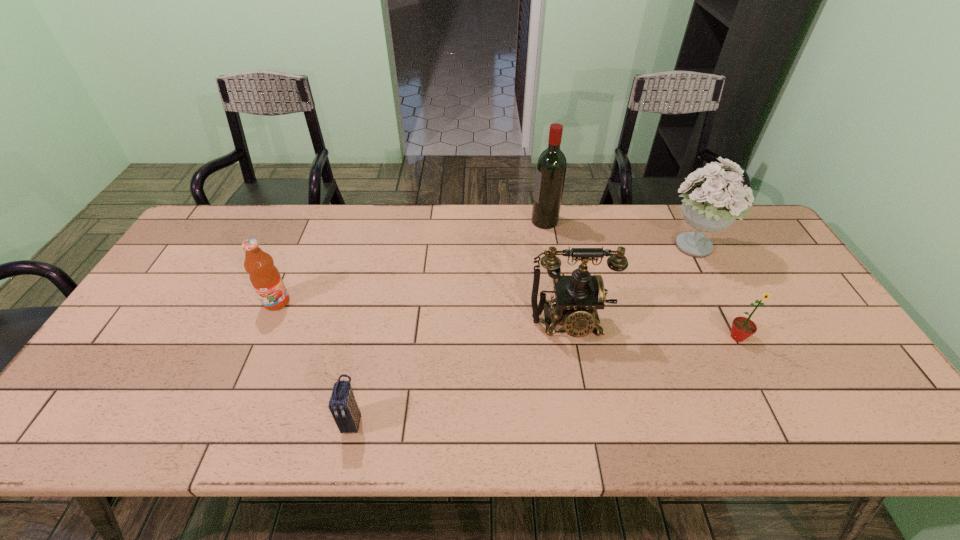
The width and height of the screenshot is (960, 540). I want to click on free space located 0.230m on the label of the wine bottle, so click(464, 221).

This screenshot has width=960, height=540. Identify the location of blank space located 0.350m on the left of the bouquet. 550,248.

The image size is (960, 540). In order to click on free space located on the rotary dial of the third tallest object in this screenshot , I will do tap(582, 391).

Locate an element on the screen. This screenshot has height=540, width=960. vacant space located 0.360m on the front label of the fruit juice is located at coordinates (217, 438).

Locate an element on the screen. vacant space situated 0.180m on the face of the second shortest object is located at coordinates (775, 410).

Where is `wine bottle at the far edge`? The width and height of the screenshot is (960, 540). wine bottle at the far edge is located at coordinates (551, 166).

Locate an element on the screen. The image size is (960, 540). bouquet that is at the far edge is located at coordinates (710, 204).

Where is `object present at the near edge`? This screenshot has width=960, height=540. object present at the near edge is located at coordinates (343, 406).

Image resolution: width=960 pixels, height=540 pixels. I want to click on object present at the right edge, so click(710, 204).

I want to click on object positioned at the far right corner, so click(710, 204).